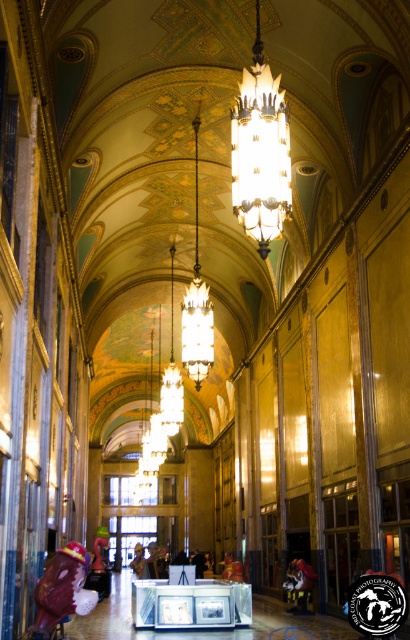
Question: Which point is farther to the camera?

Choices:
 (A) matte glass chandelier at center
 (B) gold metallic chandelier at center

Answer: (B)

Question: Which of the following is the closest to the observer?

Choices:
 (A) (193, 289)
 (B) (255, 209)

Answer: (B)

Question: Is the position of matte glass chandelier at center less distant than that of gold metallic chandelier at center?

Choices:
 (A) no
 (B) yes

Answer: (B)

Question: Which point appears closest to the camera in this image?

Choices:
 (A) (236, 211)
 (B) (186, 326)

Answer: (A)

Question: Can you confirm if matte glass chandelier at center is positioned to the right of gold metallic chandelier at center?

Choices:
 (A) yes
 (B) no

Answer: (A)

Question: In this image, where is matte glass chandelier at center located relative to gold metallic chandelier at center?

Choices:
 (A) above
 (B) below

Answer: (A)